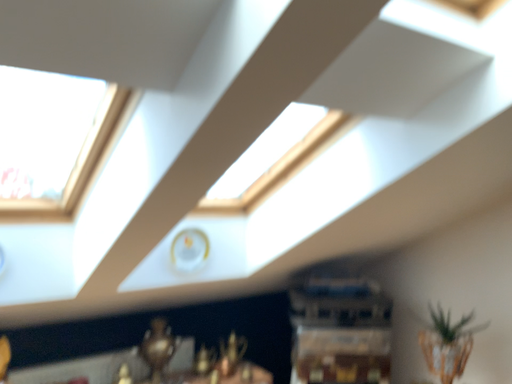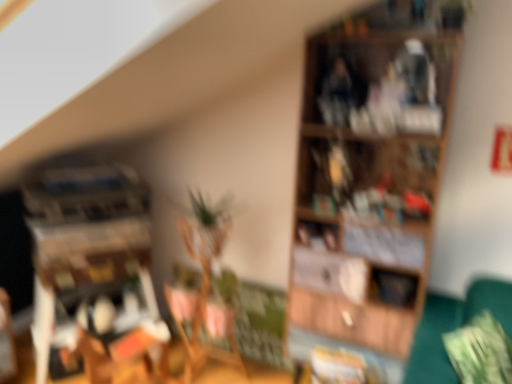
Question: Which way did the camera rotate in the video?

Choices:
 (A) rotated upward
 (B) rotated downward

Answer: (B)